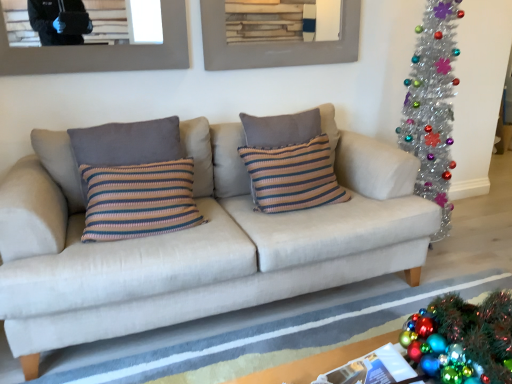
Question: Is the position of beige fabric couch at center more distant than that of shiny metallic wreath at lower right?

Choices:
 (A) yes
 (B) no

Answer: (A)

Question: From a real-world perspective, is beige fabric couch at center physically above shiny metallic wreath at lower right?

Choices:
 (A) no
 (B) yes

Answer: (B)

Question: From the image's perspective, is beige fabric couch at center on top of shiny metallic wreath at lower right?

Choices:
 (A) no
 (B) yes

Answer: (B)

Question: Is beige fabric couch at center wider than shiny metallic wreath at lower right?

Choices:
 (A) no
 (B) yes

Answer: (B)

Question: Is shiny metallic wreath at lower right at the back of beige fabric couch at center?

Choices:
 (A) no
 (B) yes

Answer: (A)

Question: Considering the relative sizes of beige fabric couch at center and shiny metallic wreath at lower right in the image provided, is beige fabric couch at center smaller than shiny metallic wreath at lower right?

Choices:
 (A) no
 (B) yes

Answer: (A)

Question: Is striped fabric pillow at left, marked as the 1th pillow in a left-to-right arrangement, facing away from striped knit pillow at center, acting as the 2th pillow starting from the left?

Choices:
 (A) no
 (B) yes

Answer: (A)

Question: Considering the relative sizes of striped fabric pillow at left, the 2th pillow positioned from the right, and striped knit pillow at center, acting as the 2th pillow starting from the left, in the image provided, is striped fabric pillow at left, the 2th pillow positioned from the right, wider than striped knit pillow at center, acting as the 2th pillow starting from the left,?

Choices:
 (A) no
 (B) yes

Answer: (A)

Question: Can you confirm if striped fabric pillow at left, marked as the 1th pillow in a left-to-right arrangement, is positioned to the right of striped knit pillow at center, acting as the first pillow starting from the right?

Choices:
 (A) yes
 (B) no

Answer: (B)

Question: Considering the relative positions of striped fabric pillow at left, marked as the 1th pillow in a left-to-right arrangement, and striped knit pillow at center, acting as the 2th pillow starting from the left, in the image provided, is striped fabric pillow at left, marked as the 1th pillow in a left-to-right arrangement, to the left of striped knit pillow at center, acting as the 2th pillow starting from the left, from the viewer's perspective?

Choices:
 (A) yes
 (B) no

Answer: (A)

Question: Are striped fabric pillow at left, the 2th pillow positioned from the right, and striped knit pillow at center, acting as the first pillow starting from the right, making contact?

Choices:
 (A) no
 (B) yes

Answer: (A)

Question: Can you confirm if striped fabric pillow at left, the 2th pillow positioned from the right, is taller than striped knit pillow at center, acting as the first pillow starting from the right?

Choices:
 (A) yes
 (B) no

Answer: (B)

Question: Can you see white fabric rug at lower center touching beige fabric couch at center?

Choices:
 (A) yes
 (B) no

Answer: (B)